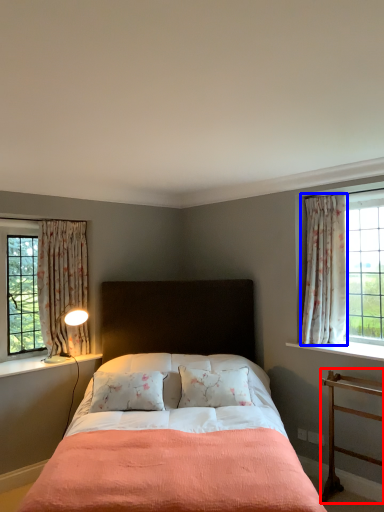
Question: Which of the following is the farthest to the observer, nightstand (highlighted by a red box) or curtain (highlighted by a blue box)?

Choices:
 (A) nightstand
 (B) curtain

Answer: (B)